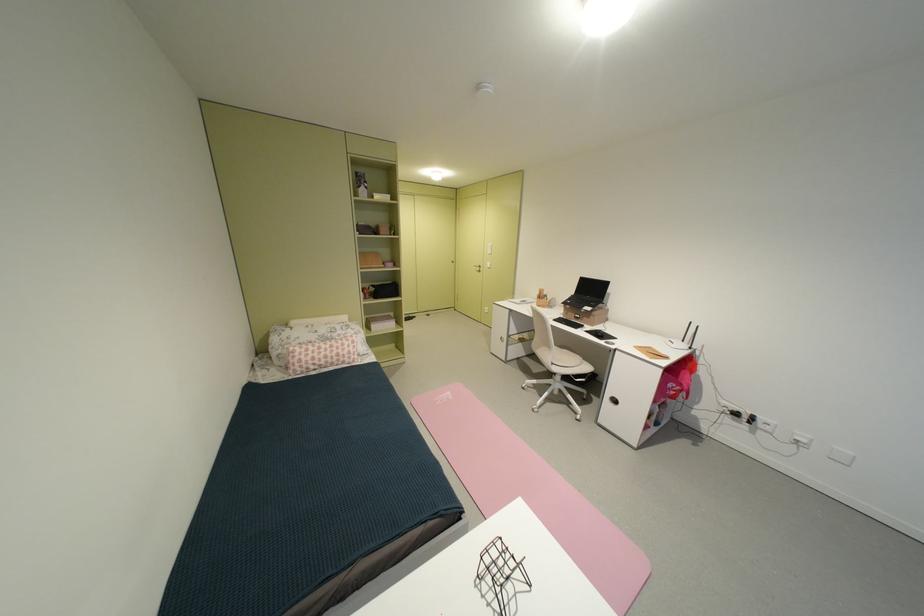
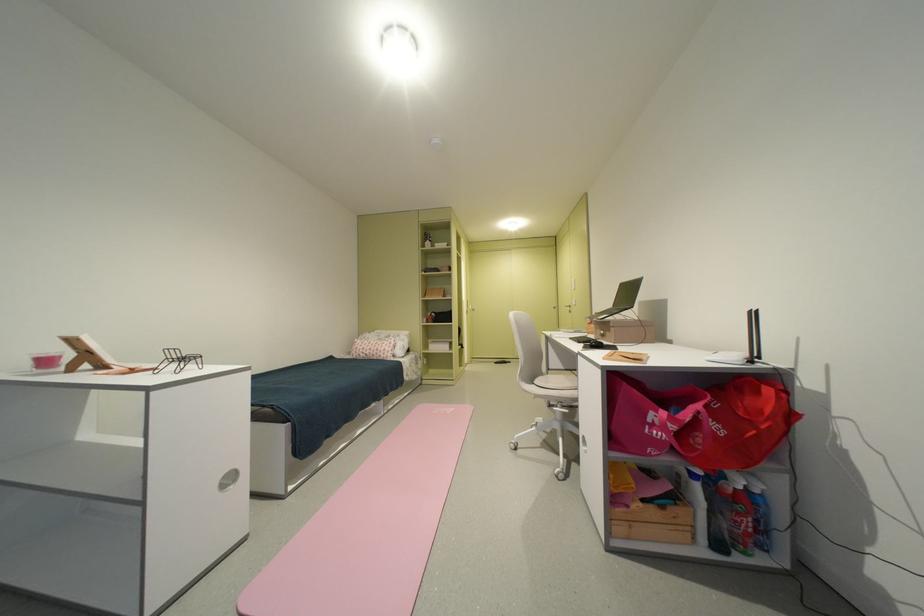
The point at (446, 405) is marked in the first image. Where is the corresponding point in the second image?

(444, 413)